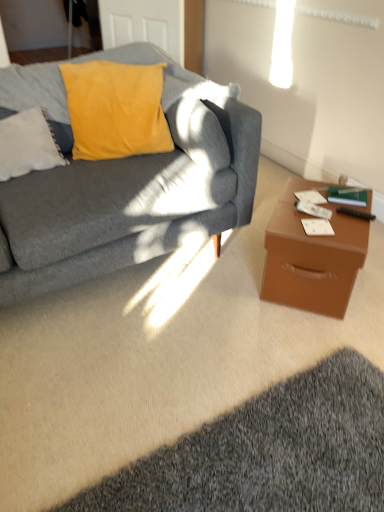
Question: Is black plastic remote control at right in front of or behind green matte book at right in the image?

Choices:
 (A) front
 (B) behind

Answer: (A)

Question: Is black plastic remote control at right bigger or smaller than green matte book at right?

Choices:
 (A) big
 (B) small

Answer: (B)

Question: Which object is the farthest from the matte gray couch at left?

Choices:
 (A) green matte book at right
 (B) dark gray shaggy rug at lower right
 (C) white fluffy pillow at upper left
 (D) black plastic remote control at right
 (E) brown leather desk at right

Answer: (B)

Question: Which of these objects is positioned closest to the green matte book at right?

Choices:
 (A) brown leather desk at right
 (B) black plastic remote control at right
 (C) dark gray shaggy rug at lower right
 (D) matte gray couch at left
 (E) white fluffy pillow at upper left

Answer: (B)